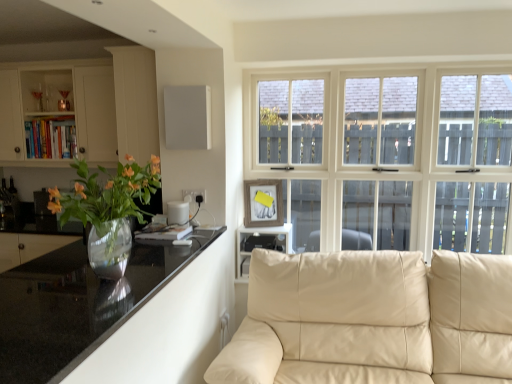
Question: Is black plastic shelf at center to the right of translucent glass vase at left from the viewer's perspective?

Choices:
 (A) no
 (B) yes

Answer: (B)

Question: Considering the relative sizes of black plastic shelf at center and translucent glass vase at left in the image provided, is black plastic shelf at center shorter than translucent glass vase at left?

Choices:
 (A) no
 (B) yes

Answer: (B)

Question: Would you consider black plastic shelf at center to be distant from translucent glass vase at left?

Choices:
 (A) yes
 (B) no

Answer: (A)

Question: Is black plastic shelf at center facing away from translucent glass vase at left?

Choices:
 (A) yes
 (B) no

Answer: (B)

Question: Can you confirm if black plastic shelf at center is bigger than translucent glass vase at left?

Choices:
 (A) no
 (B) yes

Answer: (A)

Question: From a real-world perspective, relative to black glossy countertop at left, is translucent glass vase at left vertically above or below?

Choices:
 (A) below
 (B) above

Answer: (B)

Question: Visually, is translucent glass vase at left positioned to the left or to the right of black glossy countertop at left?

Choices:
 (A) right
 (B) left

Answer: (B)

Question: Considering their positions, is translucent glass vase at left located in front of or behind black glossy countertop at left?

Choices:
 (A) behind
 (B) front

Answer: (A)

Question: Is translucent glass vase at left wider or thinner than black glossy countertop at left?

Choices:
 (A) thin
 (B) wide

Answer: (A)

Question: Is black glossy countertop at left situated inside beige leather couch at lower right or outside?

Choices:
 (A) outside
 (B) inside

Answer: (A)

Question: Relative to beige leather couch at lower right, is black glossy countertop at left in front or behind?

Choices:
 (A) front
 (B) behind

Answer: (A)

Question: In terms of size, does black glossy countertop at left appear bigger or smaller than beige leather couch at lower right?

Choices:
 (A) small
 (B) big

Answer: (A)

Question: Considering the positions of black glossy countertop at left and beige leather couch at lower right in the image, is black glossy countertop at left wider or thinner than beige leather couch at lower right?

Choices:
 (A) wide
 (B) thin

Answer: (B)

Question: In the image, is black glossy countertop at left positioned in front of or behind matte white cabinet at left?

Choices:
 (A) behind
 (B) front

Answer: (B)

Question: From the image's perspective, is black glossy countertop at left above or below matte white cabinet at left?

Choices:
 (A) below
 (B) above

Answer: (A)